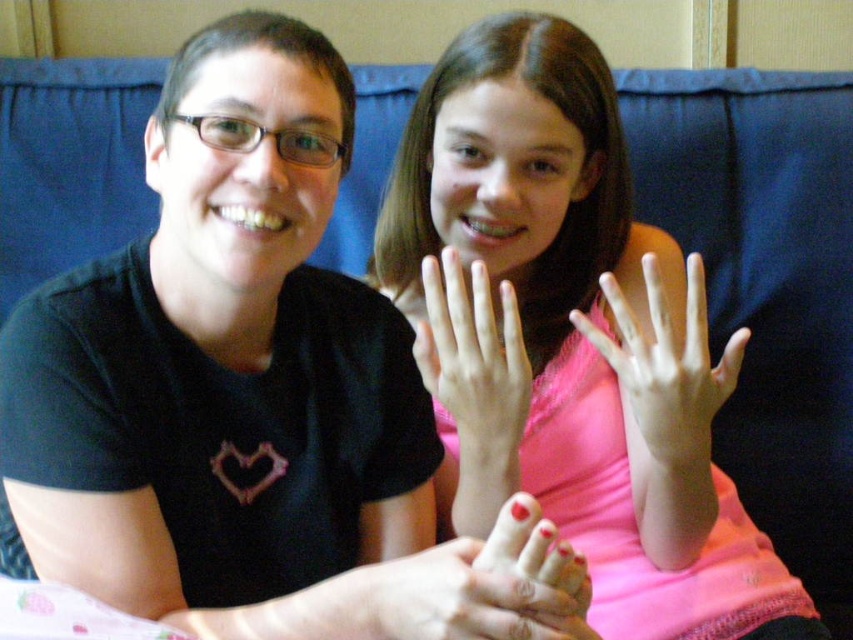
You are a photographer trying to capture a closeup of both hands in the image. Given that the pink matte hand at center and the pale skin hand at center are overlapping, which hand should you adjust to ensure both are fully visible in the frame?

The pink matte hand at center is much taller than the pale skin hand at center, so you should adjust the pink matte hand at center to position it lower so that both hands can be fully visible in the frame.

In the scene shown: You are a photographer trying to focus on the pink matte shirt at upper center and the pink matte hand at center in the image. Which object is closer to the camera?

The pink matte shirt at upper center is closer to the camera because it is in front of the pink matte hand at center.